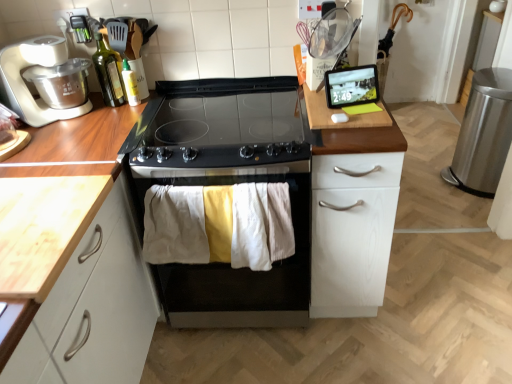
The height and width of the screenshot is (384, 512). Find the location of `free point above light wood countertop at left (from a real-world perspective)`. free point above light wood countertop at left (from a real-world perspective) is located at coordinates (38, 210).